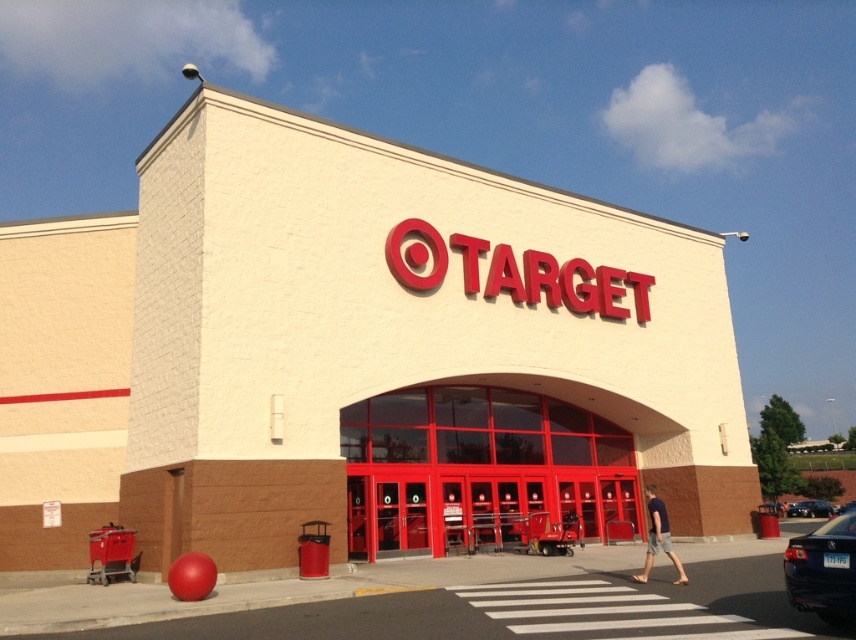
You are standing in front of the Target store and want to enter through the shiny glass doors at center. Based on the coordinates provided, which direction should you walk relative to your current position to reach the doors?

The shiny glass doors at center are located at coordinates point (479, 467), so you should walk towards the center of the store to reach them.

You are a delivery driver who needs to park your vehicle in the parking lot in front of the Target store. You have a shiny black sedan at lower right and a metallic red shopping cart at lower left in your view. Which vehicle has more space between its sides when parked side by side?

The shiny black sedan at lower right has a greater width than the metallic red shopping cart at lower left, so there would be more space between their sides when parked side by side.